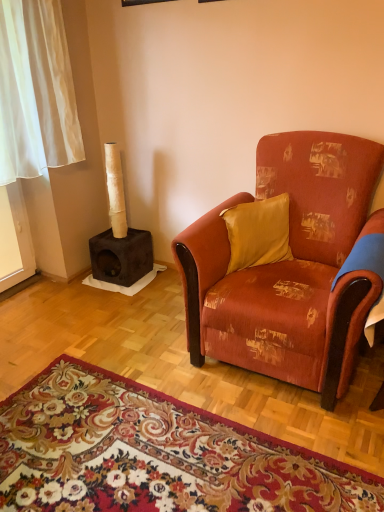
Question: Is dark brown suede cat tree at left at the back of textured orange fabric armchair at center?

Choices:
 (A) no
 (B) yes

Answer: (A)

Question: From a real-world perspective, is textured orange fabric armchair at center on dark brown suede cat tree at left?

Choices:
 (A) no
 (B) yes

Answer: (B)

Question: Could you tell me if textured orange fabric armchair at center is turned towards dark brown suede cat tree at left?

Choices:
 (A) yes
 (B) no

Answer: (B)

Question: From the image's perspective, is textured orange fabric armchair at center below dark brown suede cat tree at left?

Choices:
 (A) no
 (B) yes

Answer: (B)

Question: Is textured orange fabric armchair at center behind dark brown suede cat tree at left?

Choices:
 (A) no
 (B) yes

Answer: (A)

Question: Is satin yellow pillow at center inside the boundaries of dark brown suede cat tree at left, or outside?

Choices:
 (A) inside
 (B) outside

Answer: (B)

Question: Considering the positions of satin yellow pillow at center and dark brown suede cat tree at left in the image, is satin yellow pillow at center bigger or smaller than dark brown suede cat tree at left?

Choices:
 (A) big
 (B) small

Answer: (B)

Question: From the image's perspective, is satin yellow pillow at center above or below dark brown suede cat tree at left?

Choices:
 (A) below
 (B) above

Answer: (A)

Question: Considering their positions, is satin yellow pillow at center located in front of or behind dark brown suede cat tree at left?

Choices:
 (A) front
 (B) behind

Answer: (A)

Question: Considering the positions of satin yellow pillow at center and floral carpet at lower center in the image, is satin yellow pillow at center taller or shorter than floral carpet at lower center?

Choices:
 (A) short
 (B) tall

Answer: (B)

Question: Relative to floral carpet at lower center, is satin yellow pillow at center in front or behind?

Choices:
 (A) front
 (B) behind

Answer: (B)

Question: In terms of width, does satin yellow pillow at center look wider or thinner when compared to floral carpet at lower center?

Choices:
 (A) wide
 (B) thin

Answer: (B)

Question: From the image's perspective, is satin yellow pillow at center above or below floral carpet at lower center?

Choices:
 (A) below
 (B) above

Answer: (B)

Question: In terms of height, does dark brown suede cat tree at left look taller or shorter compared to satin yellow pillow at center?

Choices:
 (A) tall
 (B) short

Answer: (A)

Question: In terms of width, does dark brown suede cat tree at left look wider or thinner when compared to satin yellow pillow at center?

Choices:
 (A) wide
 (B) thin

Answer: (A)